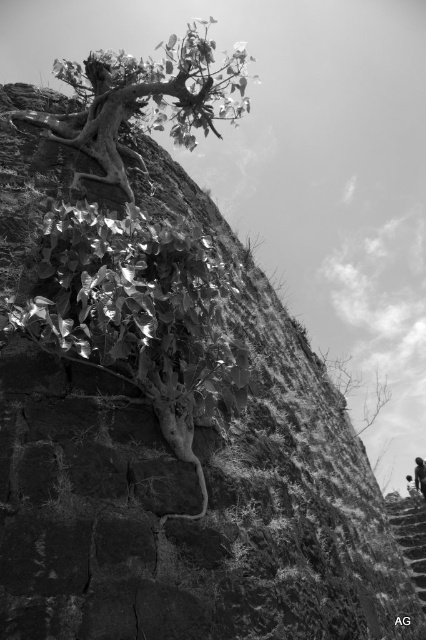
Between shiny metallic plant at center and dark skin human at lower right, which one has less height?

dark skin human at lower right

In order to click on shiny metallic plant at center in this screenshot , I will do `click(141, 316)`.

In order to click on shiny metallic plant at center in this screenshot , I will do `click(141, 316)`.

Can you confirm if rough bark tree at upper left is taller than smooth stone stairs at lower right?

Yes.

Between point (192, 96) and point (425, 531), which one is positioned behind?

Positioned behind is point (425, 531).

Is point (109, 84) farther from viewer compared to point (420, 499)?

No, it is not.

Find the location of a particular element. The width and height of the screenshot is (426, 640). rough bark tree at upper left is located at coordinates point(146,99).

Is rough bark tree at upper left shorter than dark skin human at lower right?

No.

Is rough bark tree at upper left thinner than dark skin human at lower right?

In fact, rough bark tree at upper left might be wider than dark skin human at lower right.

Between point (229, 70) and point (417, 456), which one is positioned in front?

Point (229, 70)

Where is `rough bark tree at upper left`? Image resolution: width=426 pixels, height=640 pixels. rough bark tree at upper left is located at coordinates (146, 99).